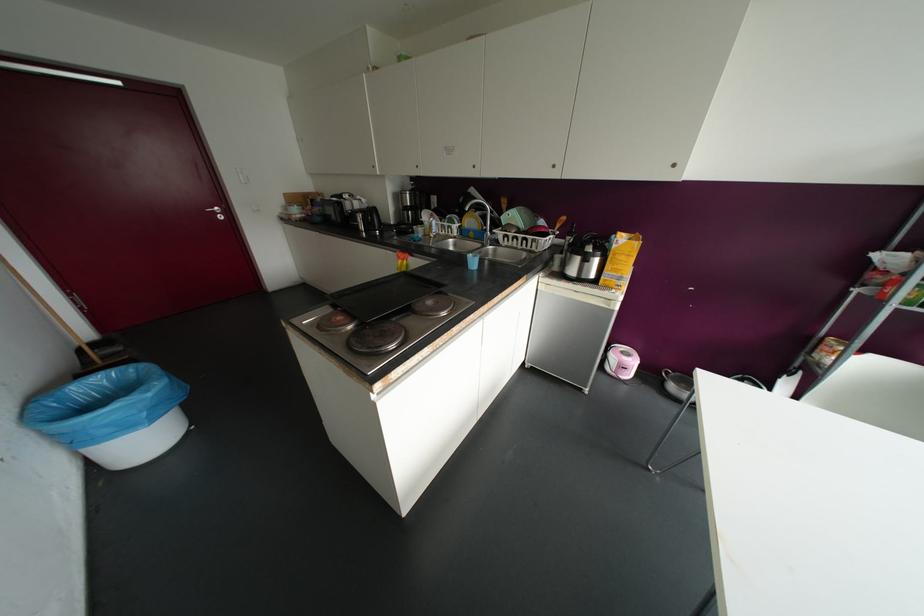
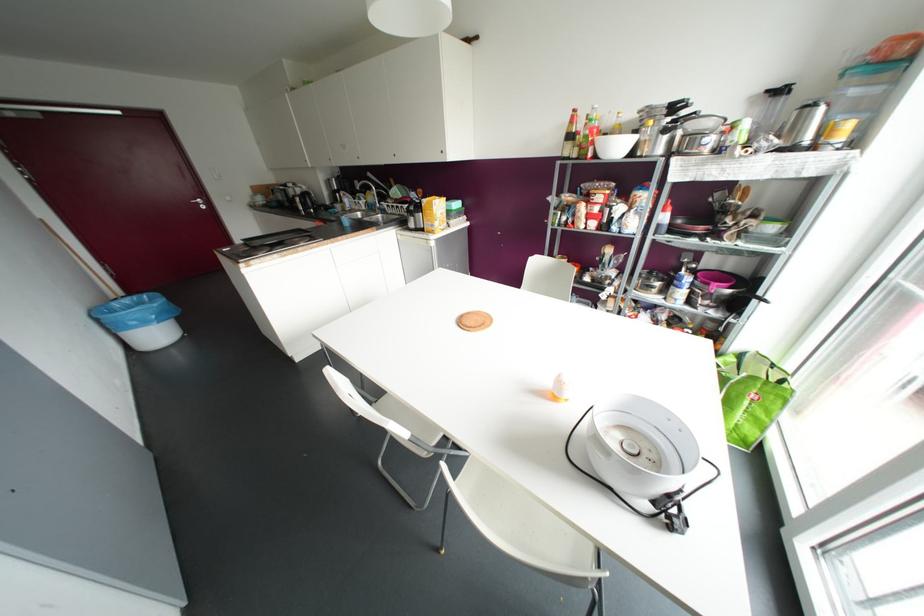
Find the pixel in the second image that matches (100,379) in the first image.

(127, 300)